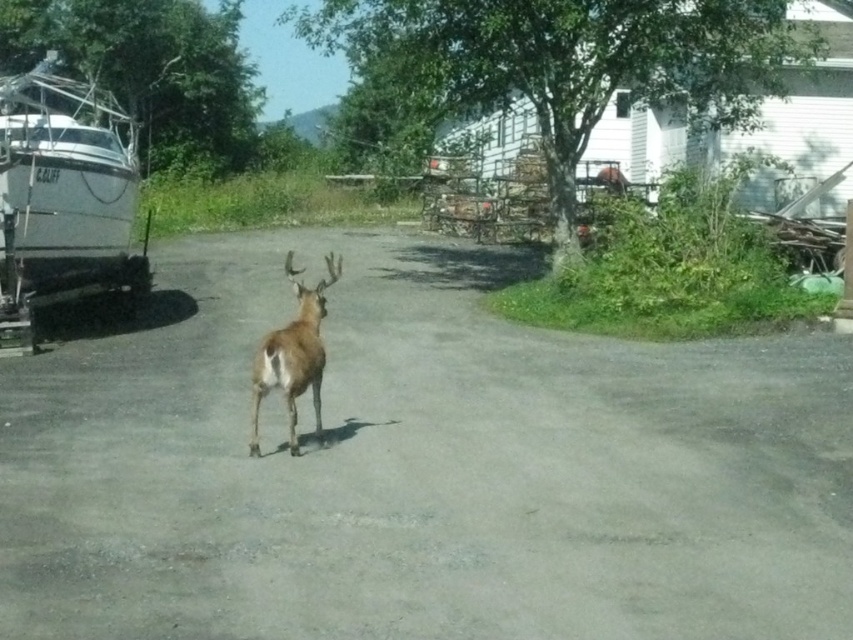
Question: Which of the following is the closest to the observer?

Choices:
 (A) white matte boat at left
 (B) brown furry deer at center

Answer: (B)

Question: Observing the image, what is the correct spatial positioning of white matte boat at left in reference to brown furry deer at center?

Choices:
 (A) left
 (B) right

Answer: (A)

Question: Considering the real-world distances, which object is closest to the white matte boat at left?

Choices:
 (A) gray asphalt driveway at center
 (B) brown furry deer at center

Answer: (A)

Question: Where is gray asphalt driveway at center located in relation to white matte boat at left in the image?

Choices:
 (A) above
 (B) below

Answer: (B)

Question: Is white matte boat at left thinner than brown furry deer at center?

Choices:
 (A) no
 (B) yes

Answer: (A)

Question: Which of the following is the closest to the observer?

Choices:
 (A) (99, 276)
 (B) (286, 365)

Answer: (B)